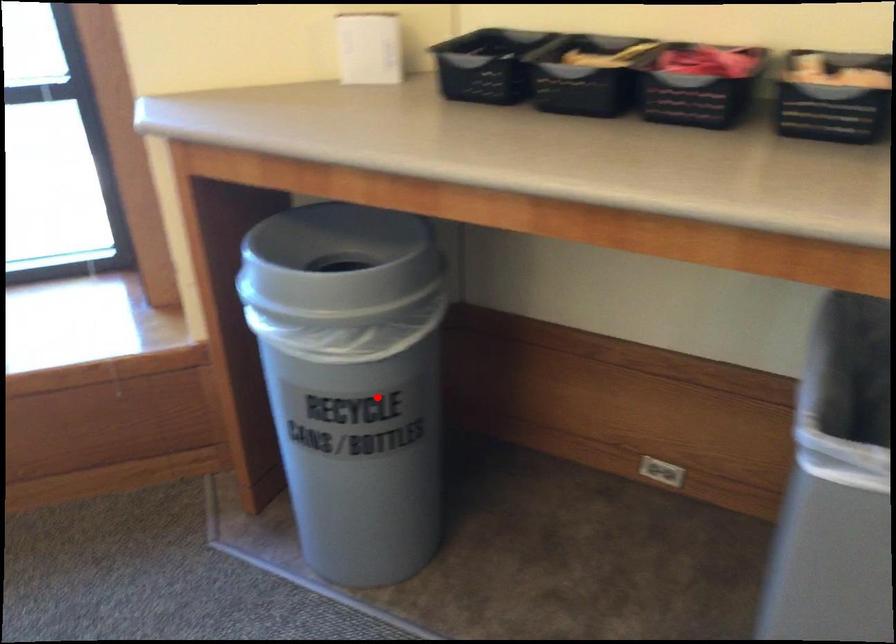
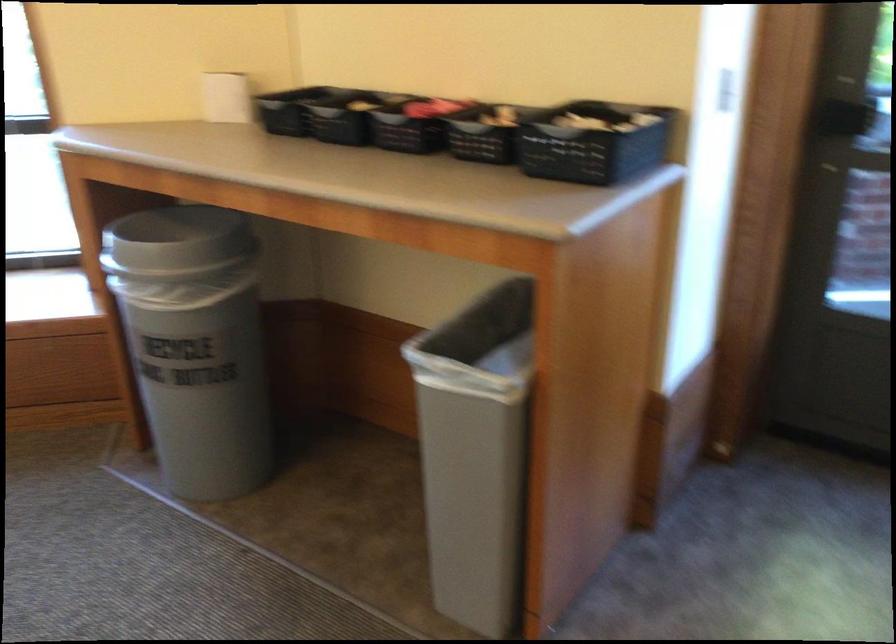
The point at the highlighted location is marked in the first image. Where is the corresponding point in the second image?

(194, 344)